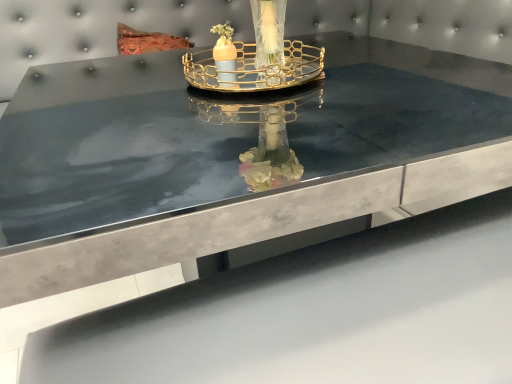
Where is `spots to the right of gold metallic tray at center`? This screenshot has height=384, width=512. spots to the right of gold metallic tray at center is located at coordinates (355, 77).